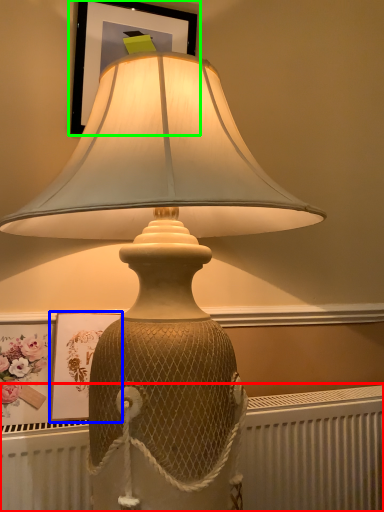
Question: Estimate the real-world distances between objects in this image. Which object is farther from radiator (highlighted by a red box), picture frame (highlighted by a blue box) or picture frame (highlighted by a green box)?

Choices:
 (A) picture frame
 (B) picture frame

Answer: (B)